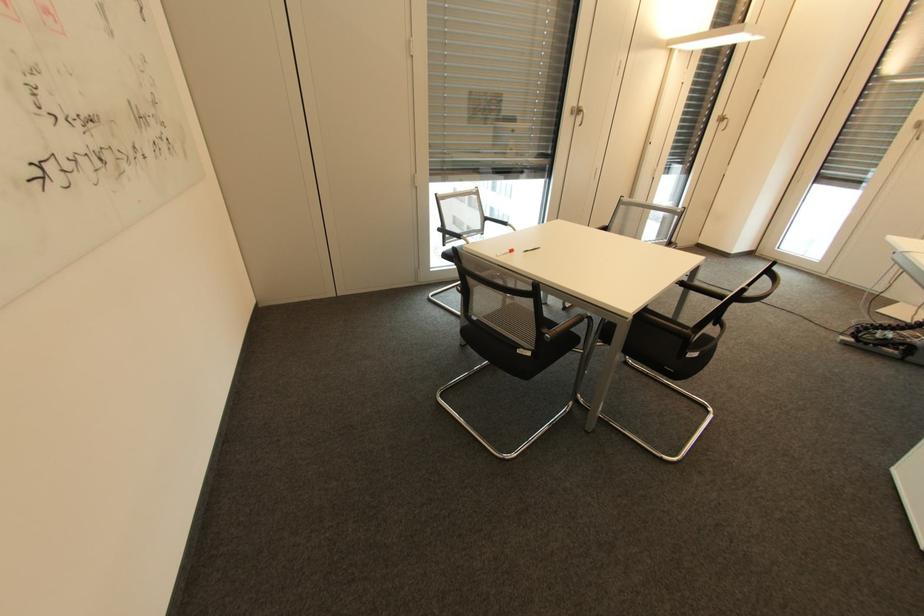
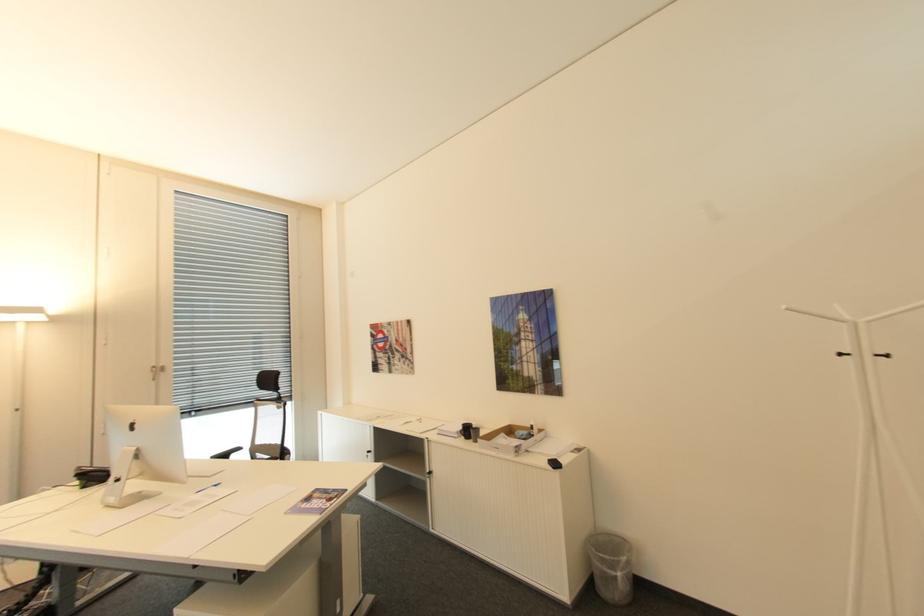
Question: The camera is either moving clockwise (left) or counter-clockwise (right) around the object. The first image is from the beginning of the video and the second image is from the end. Is the camera moving left or right when shooting the video?

Choices:
 (A) Left
 (B) Right

Answer: (A)